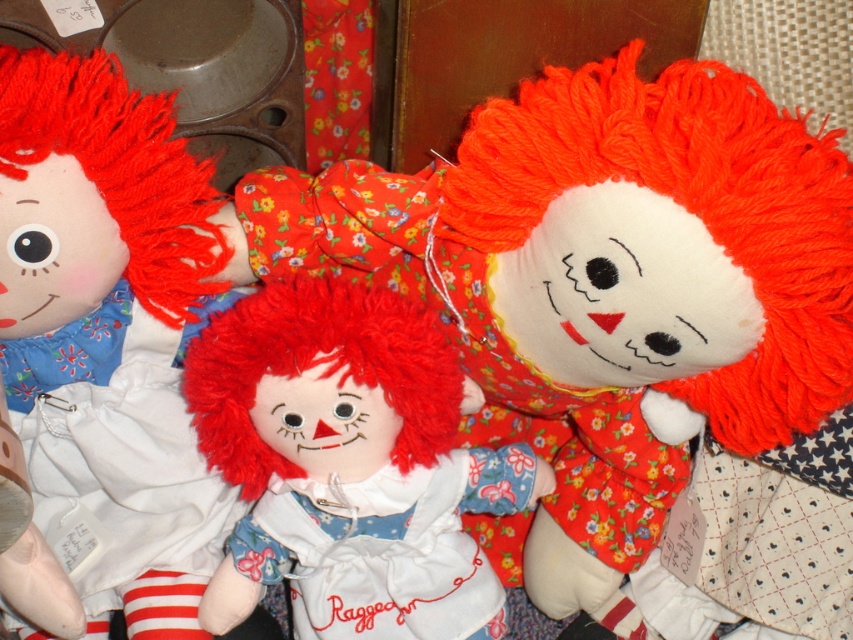
Question: Which object is farther from the camera taking this photo?

Choices:
 (A) fluffy red hair doll at center
 (B) white soft doll at left

Answer: (A)

Question: Can you confirm if white soft doll at left is positioned to the right of fluffy red hair doll at center?

Choices:
 (A) yes
 (B) no

Answer: (B)

Question: Which object appears farthest from the camera in this image?

Choices:
 (A) white soft doll at left
 (B) fluffy red hair doll at center

Answer: (B)

Question: Which point is closer to the camera?

Choices:
 (A) (189, 458)
 (B) (328, 364)

Answer: (B)

Question: Where is white soft doll at left located in relation to fluffy red hair doll at center in the image?

Choices:
 (A) right
 (B) left

Answer: (B)

Question: In this image, where is white soft doll at left located relative to fluffy red hair doll at center?

Choices:
 (A) left
 (B) right

Answer: (A)